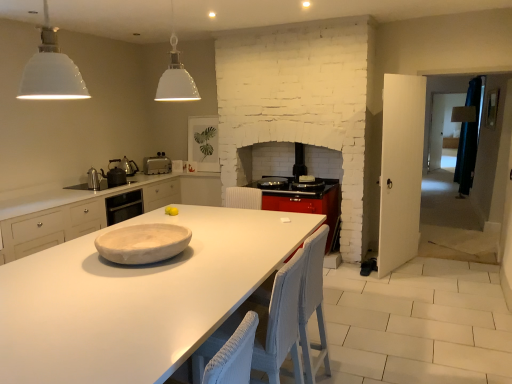
Identify the location of empty space that is ontop of white matte countertop at center. Image resolution: width=512 pixels, height=384 pixels. (143, 276).